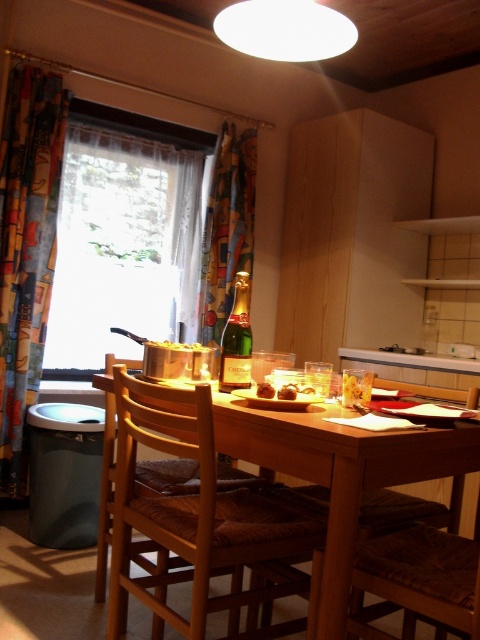
Who is more forward, (456, 438) or (196, 342)?

Point (456, 438)

Who is taller, wooden table at center or yellowish matte pot at center?

Standing taller between the two is wooden table at center.

Which is in front, point (320, 436) or point (200, 344)?

Point (320, 436) is in front.

The width and height of the screenshot is (480, 640). In order to click on wooden table at center in this screenshot , I will do `click(344, 474)`.

Between point (254, 176) and point (309, 396), which one is positioned in front?

Point (309, 396)

Who is positioned more to the right, multicolored fabric curtain at center or brown chocolate truffle at table center?

From the viewer's perspective, brown chocolate truffle at table center appears more on the right side.

At what (x,y) coordinates should I click in order to perform the action: click on multicolored fabric curtain at center. Please return your answer as a coordinate pair (x, y). This screenshot has width=480, height=640. Looking at the image, I should click on (227, 227).

Identify the location of multicolored fabric curtain at center. This screenshot has height=640, width=480. (227, 227).

Can you confirm if multicolored fabric curtain at left is positioned below translucent glass bottle at center?

No.

Is multicolored fabric curtain at left thinner than translucent glass bottle at center?

In fact, multicolored fabric curtain at left might be wider than translucent glass bottle at center.

The image size is (480, 640). What do you see at coordinates (25, 248) in the screenshot?
I see `multicolored fabric curtain at left` at bounding box center [25, 248].

Locate an element on the screen. Image resolution: width=480 pixels, height=640 pixels. multicolored fabric curtain at left is located at coordinates (25, 248).